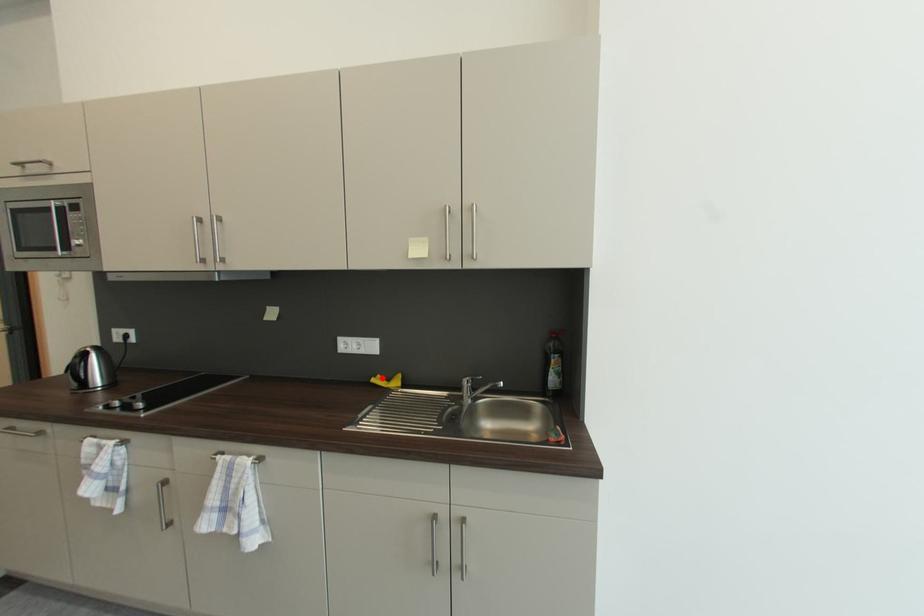
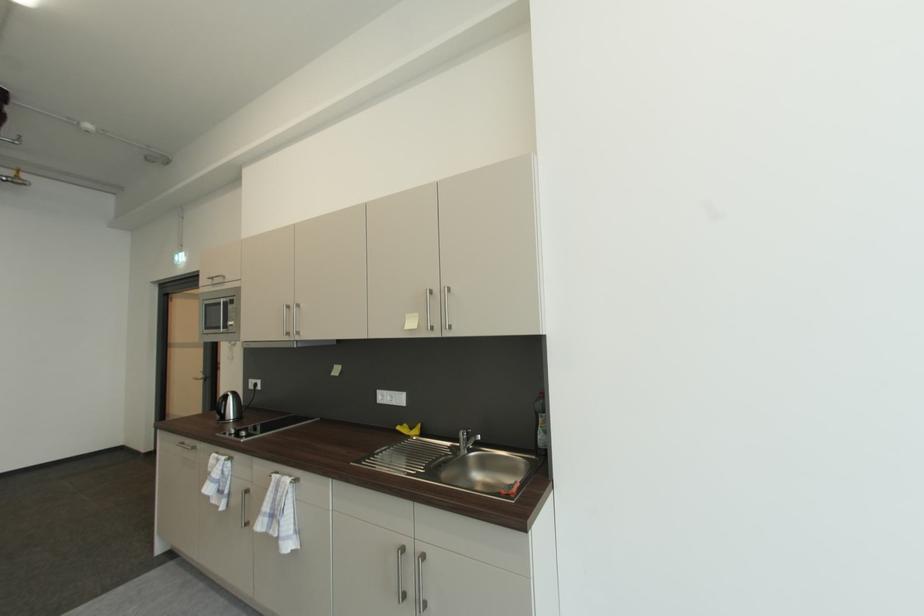
Where in the second image is the point corresponding to the highlighted location from the first image?

(408, 427)